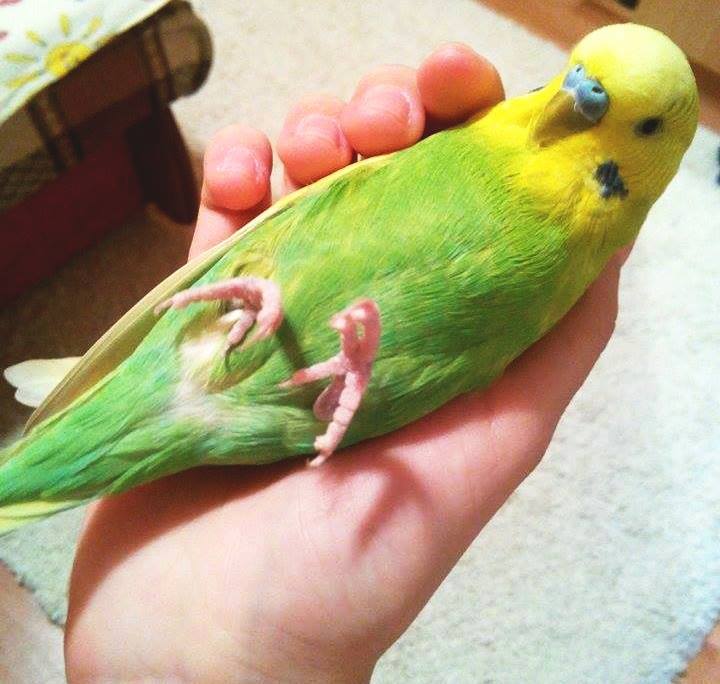
Image resolution: width=720 pixels, height=684 pixels. In order to click on floor in this screenshot , I will do `click(706, 659)`.